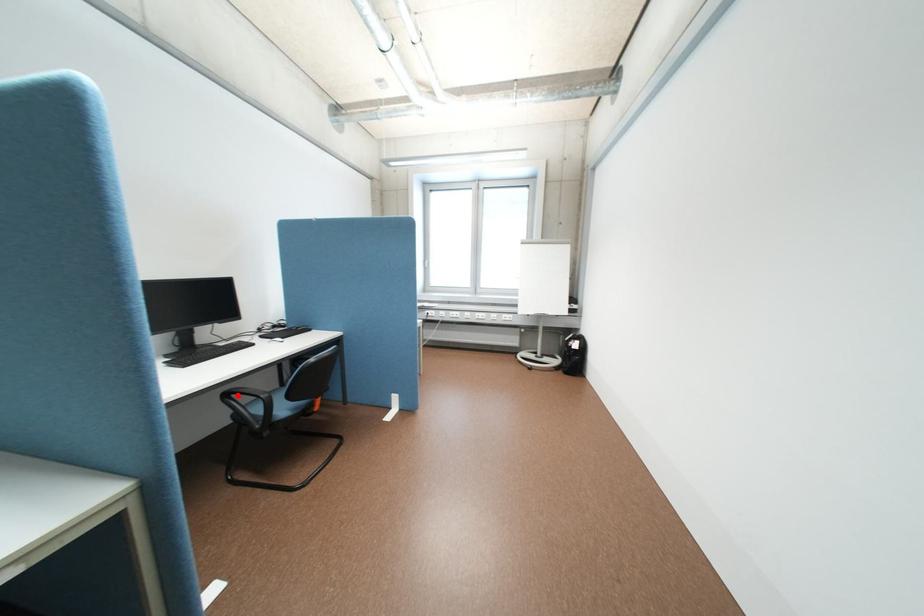
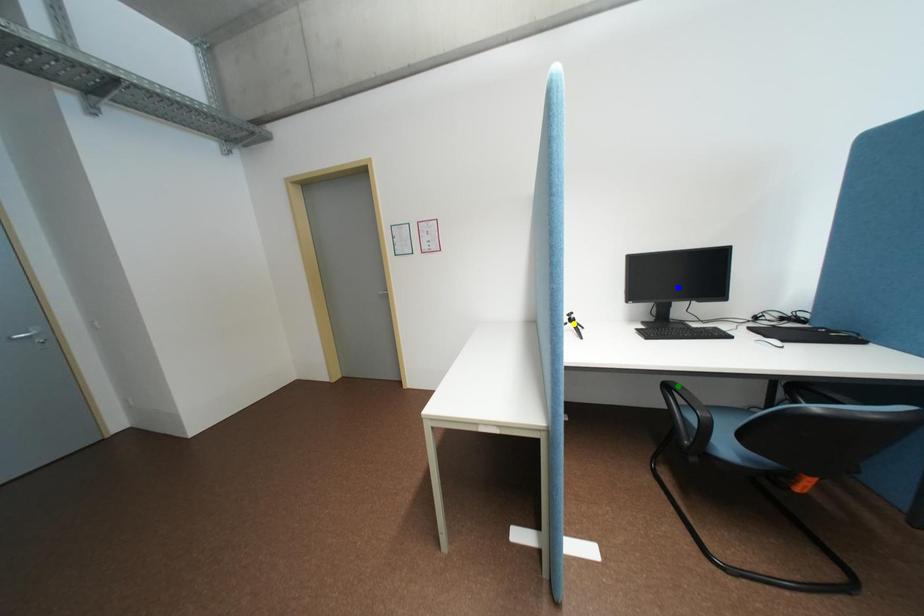
Question: I am providing you with two images of the same scene from different viewpoints. A red point is marked on the first image. You are given multiple points on the second image. In image 2, which mark is for the same physical point as the one in image 1?

Choices:
 (A) yellow point
 (B) green point
 (C) blue point

Answer: (B)